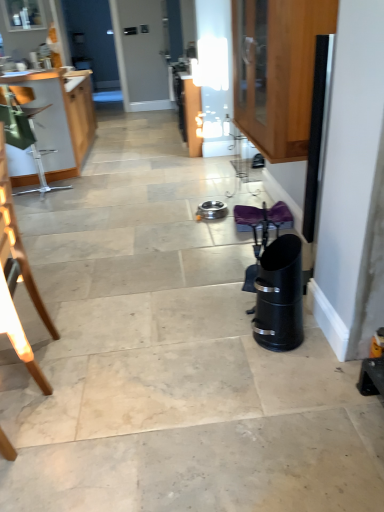
Identify the location of blank area beneath wooden chair at left (from a real-world perspective). The image size is (384, 512). (22, 369).